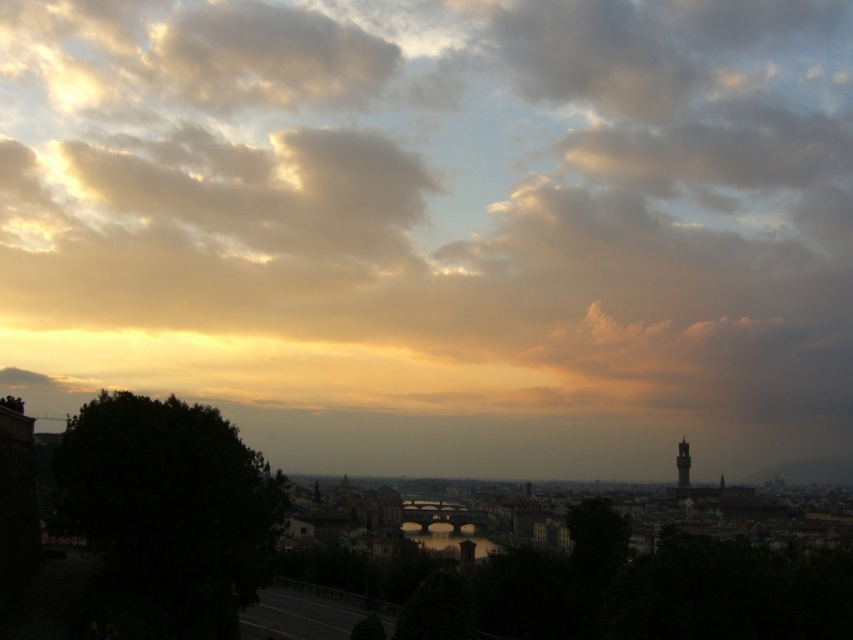
Question: Can you confirm if cloudy sky at upper center is positioned to the left of dark gray stone tower at right?

Choices:
 (A) yes
 (B) no

Answer: (A)

Question: Which point is closer to the camera taking this photo?

Choices:
 (A) (488, 104)
 (B) (683, 474)

Answer: (B)

Question: Can you confirm if cloudy sky at upper center is positioned to the left of dark gray stone tower at right?

Choices:
 (A) no
 (B) yes

Answer: (B)

Question: Which point appears farthest from the camera in this image?

Choices:
 (A) (312, 401)
 (B) (686, 470)

Answer: (A)

Question: Is cloudy sky at upper center further to camera compared to dark gray stone tower at right?

Choices:
 (A) yes
 (B) no

Answer: (A)